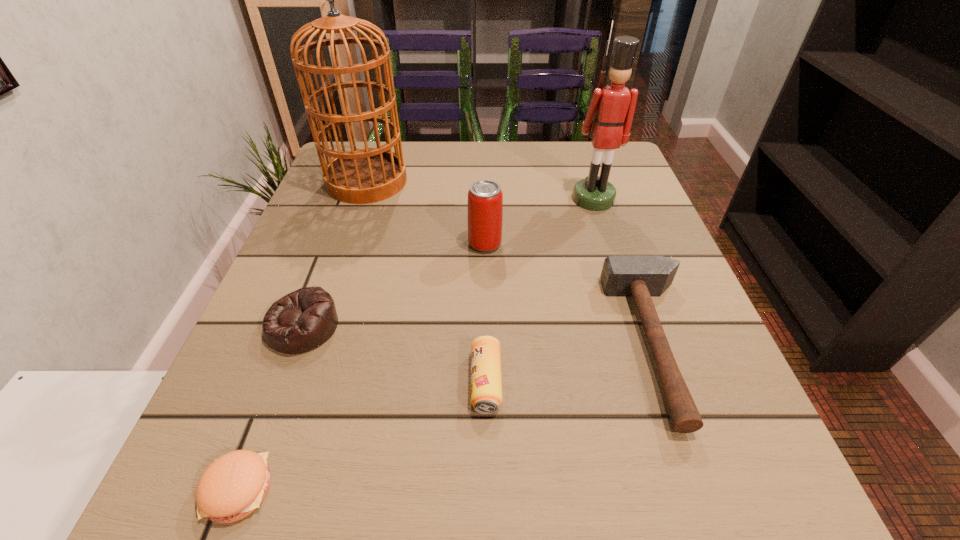
Identify the location of vacant area situated 0.290m on the right of the farther beer can. This screenshot has height=540, width=960. (647, 244).

At what (x,y) coordinates should I click in order to perform the action: click on free space located 0.060m on the front of the beanbag. Please return your answer as a coordinate pair (x, y). Looking at the image, I should click on (279, 390).

The height and width of the screenshot is (540, 960). Find the location of `free spot located 0.200m on the striking surface of the hammer`. free spot located 0.200m on the striking surface of the hammer is located at coordinates (492, 344).

I want to click on free spot located on the striking surface of the hammer, so click(536, 344).

You are a GUI agent. You are given a task and a screenshot of the screen. Output one action in this format:
    pyautogui.click(x=<x>, y=<y>)
    Task: Click on the vacant space located on the striking surface of the hammer
    
    Given the screenshot: What is the action you would take?
    pyautogui.click(x=442, y=344)

Find the location of `vacant space located on the left of the shorter beer can`. vacant space located on the left of the shorter beer can is located at coordinates (262, 381).

This screenshot has height=540, width=960. I want to click on vacant region located 0.190m on the back of the patty, so click(295, 340).

At what (x,y) coordinates should I click in order to perform the action: click on birdcage that is at the far edge. Please return your answer as a coordinate pair (x, y). The width and height of the screenshot is (960, 540). Looking at the image, I should click on (366, 175).

The image size is (960, 540). Identify the location of nutcracker present at the far edge. (609, 117).

Locate an element on the screen. Image resolution: width=960 pixels, height=540 pixels. object located in the near edge section of the desktop is located at coordinates 234,485.